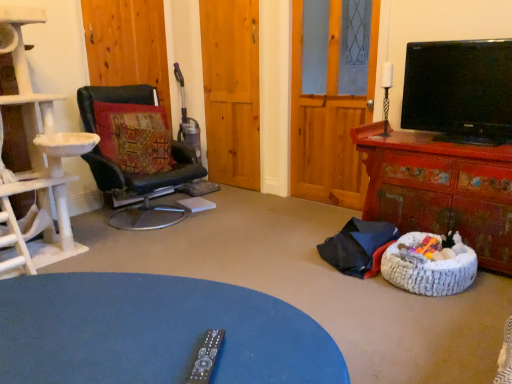
The width and height of the screenshot is (512, 384). What are the coordinates of `vacant space underneath black leather chair at left (from a real-world perspective)` in the screenshot? It's located at (154, 220).